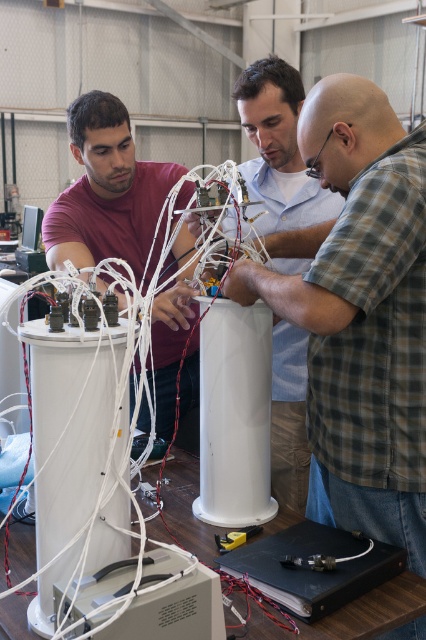
You are a technician in the workshop and need to access both the white plastic computer tower at lower center and the black plastic box at lower center. Which object would you need to move first to reach the other?

The white plastic computer tower at lower center is closer to the viewer than the black plastic box at lower center, so you would need to move the white plastic computer tower at lower center first to access the black plastic box at lower center.

Consider the image. You are working in the workshop and need to locate the matte white cylinder at center. According to the coordinates provided, where exactly is it positioned?

The matte white cylinder at center is located at point coordinates of (282, 166).

You are a technician needing to connect a camera to the white plastic computer tower at lower center. The cable you have is 35 inches long. Will the cable reach?

The white plastic computer tower at lower center and camera are 35.81 inches apart. The cable is 35 inches long, which is shorter than the required distance. The cable will not reach.